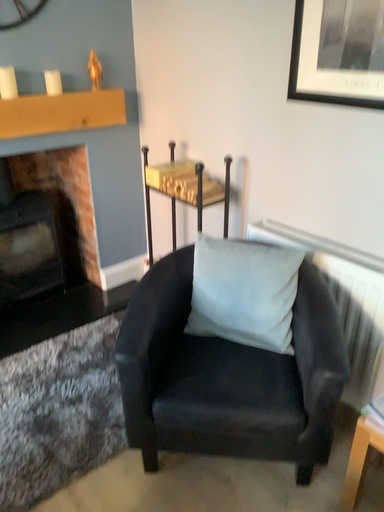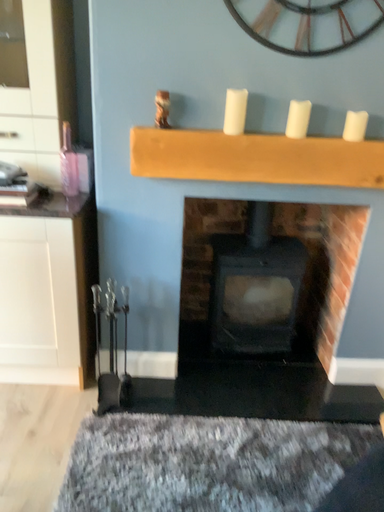
Question: How did the camera likely rotate when shooting the video?

Choices:
 (A) rotated downward
 (B) rotated upward

Answer: (B)